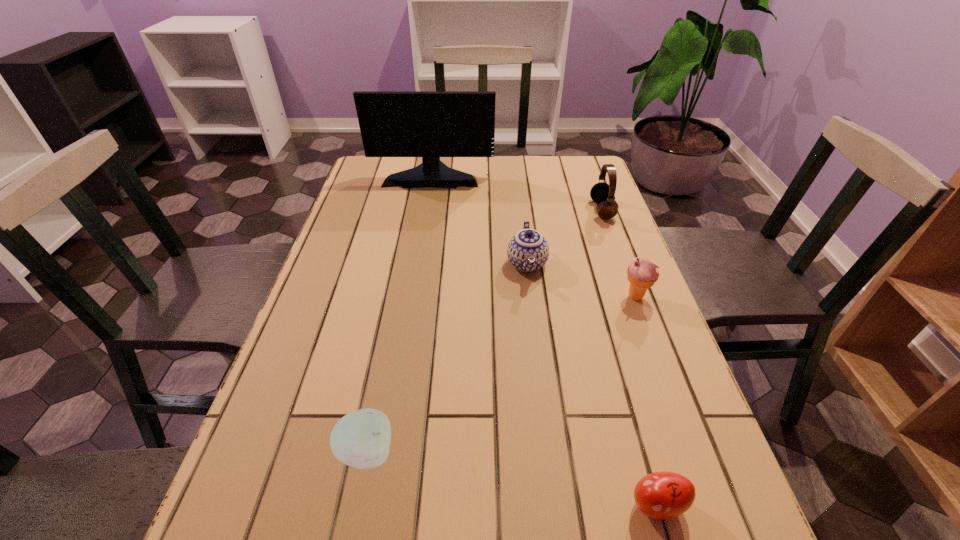
Where is `headset that is positioned at the right edge`? The width and height of the screenshot is (960, 540). headset that is positioned at the right edge is located at coordinates (602, 193).

Identify the location of icecream present at the right edge. (642, 274).

Image resolution: width=960 pixels, height=540 pixels. In order to click on apple that is positioned at the right edge in this screenshot , I will do pos(662,495).

Where is `object situated at the far left corner`? This screenshot has width=960, height=540. object situated at the far left corner is located at coordinates (430, 124).

Where is `vacant space at the far edge`? vacant space at the far edge is located at coordinates (530, 174).

In the image, there is a desktop. Identify the location of vacant space at the left edge. (350, 274).

The width and height of the screenshot is (960, 540). In order to click on vacant space at the right edge of the desktop in this screenshot , I will do `click(639, 413)`.

This screenshot has height=540, width=960. I want to click on free space at the far left corner, so click(405, 167).

At what (x,y) coordinates should I click in order to perform the action: click on free space at the far right corner of the desktop. Please return your answer as a coordinate pair (x, y). Looking at the image, I should click on (570, 165).

Identify the location of free space between the farther apple and the second farthest object. This screenshot has height=540, width=960. (484, 331).